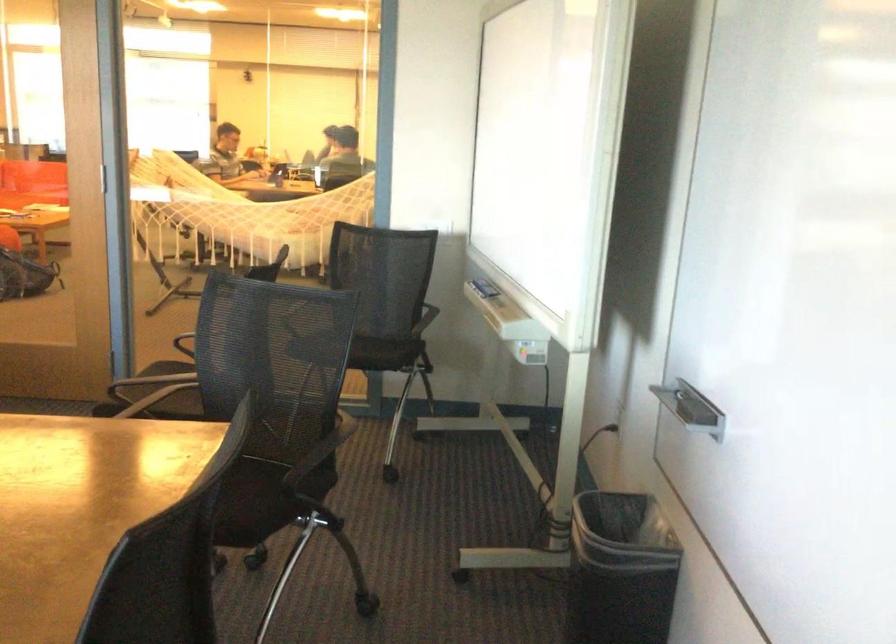
Find where to sit the orange sofa sitting surface. Please return your answer as a coordinate pair (x, y).

(21, 199)